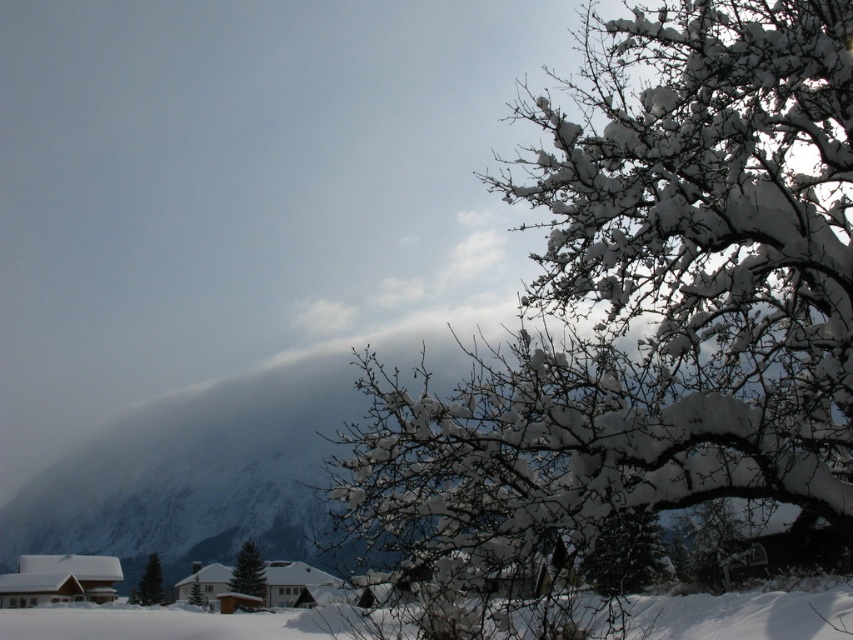
Can you confirm if snow-covered branches at upper right is positioned to the right of green matte tree at lower center?

Indeed, snow-covered branches at upper right is positioned on the right side of green matte tree at lower center.

Which of these two, snow-covered branches at upper right or green matte tree at lower center, stands taller?

With more height is snow-covered branches at upper right.

Does point (524, 193) come in front of point (201, 598)?

That is True.

At what (x,y) coordinates should I click in order to perform the action: click on snow-covered branches at upper right. Please return your answer as a coordinate pair (x, y). The height and width of the screenshot is (640, 853). Looking at the image, I should click on (642, 314).

Can you confirm if green matte evergreen tree at lower center is positioned below green matte tree at lower center?

No.

Who is positioned more to the left, green matte evergreen tree at lower center or green matte tree at lower center?

green matte tree at lower center

Describe the element at coordinates (248, 572) in the screenshot. This screenshot has height=640, width=853. I see `green matte evergreen tree at lower center` at that location.

Where is `green matte evergreen tree at lower center`? green matte evergreen tree at lower center is located at coordinates (248, 572).

Which of these two, snow-covered branches at upper right or green matte tree at lower left, stands shorter?

green matte tree at lower left

Is snow-covered branches at upper right shorter than green matte tree at lower left?

In fact, snow-covered branches at upper right may be taller than green matte tree at lower left.

Between point (682, 340) and point (132, 596), which one is positioned behind?

Point (132, 596)

This screenshot has width=853, height=640. What are the coordinates of `snow-covered branches at upper right` in the screenshot? It's located at (642, 314).